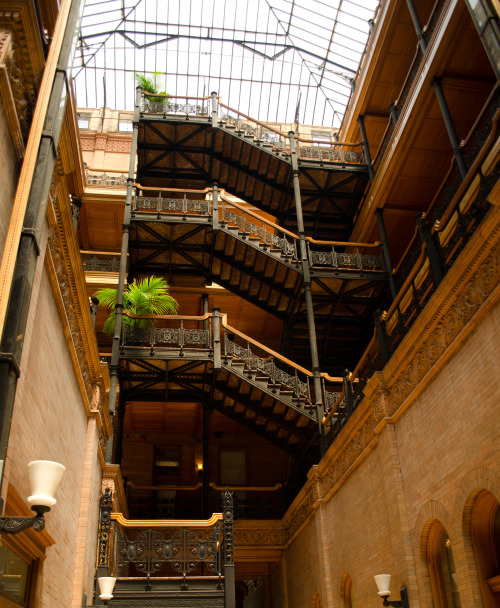
What are the coordinates of `left wall` in the screenshot? It's located at 32,410.